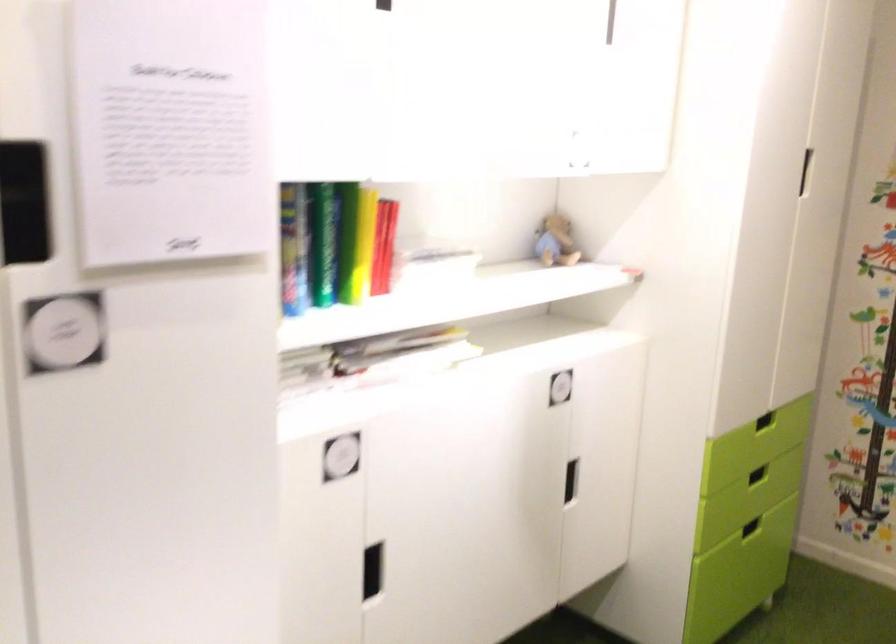
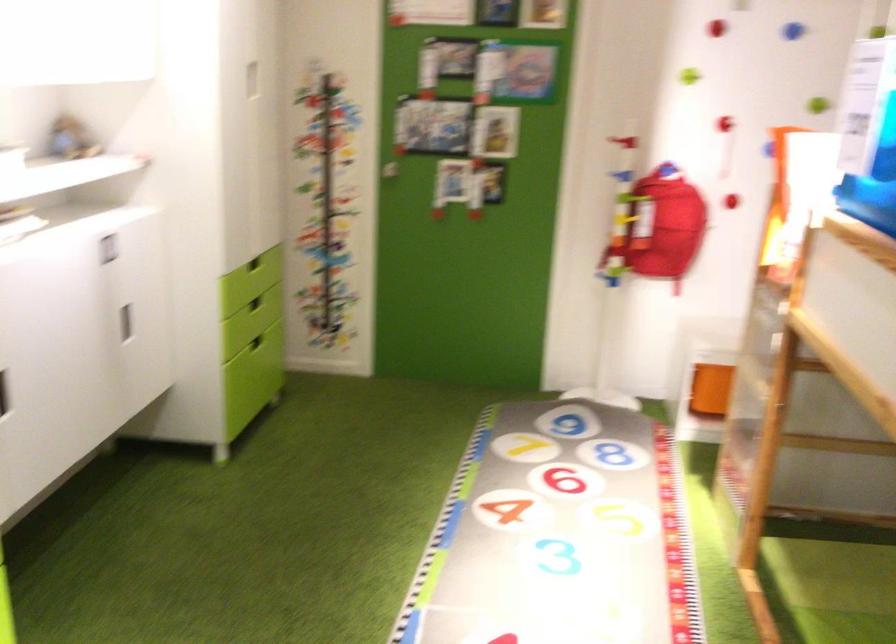
Locate, in the second image, the point that corresponds to [552,484] in the first image.

(125, 323)